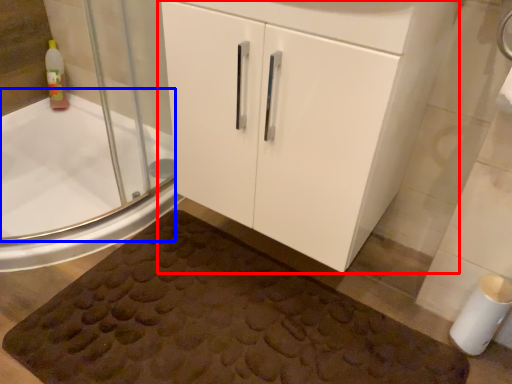
Question: Among these objects, which one is nearest to the camera, bathroom cabinet (highlighted by a red box) or bath (highlighted by a blue box)?

Choices:
 (A) bathroom cabinet
 (B) bath

Answer: (A)